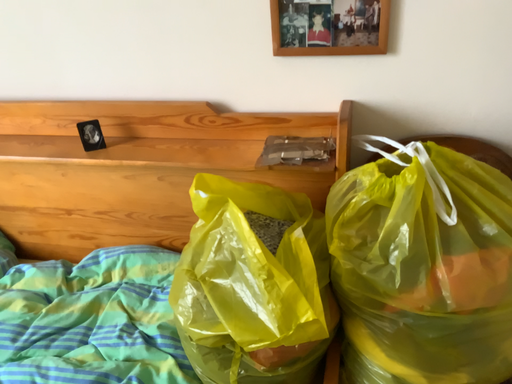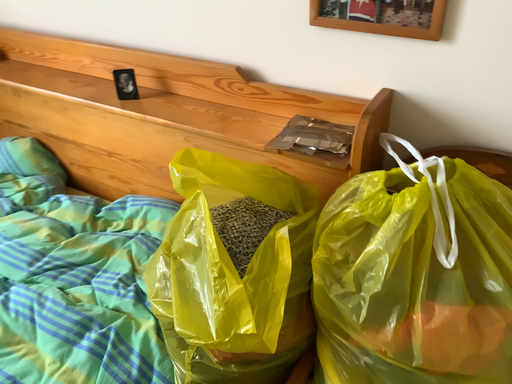
Question: How did the camera likely rotate when shooting the video?

Choices:
 (A) rotated left
 (B) rotated right

Answer: (A)